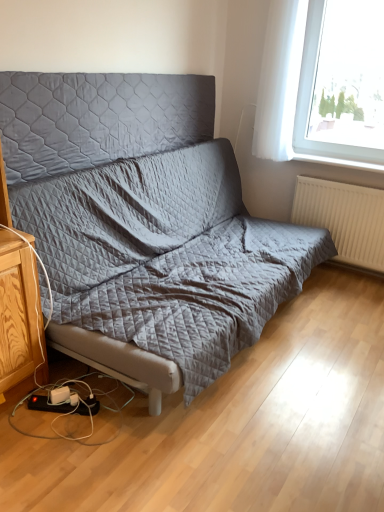
Image resolution: width=384 pixels, height=512 pixels. In order to click on vacant point to the right of black plastic power strip at lower left in this screenshot , I will do `click(110, 416)`.